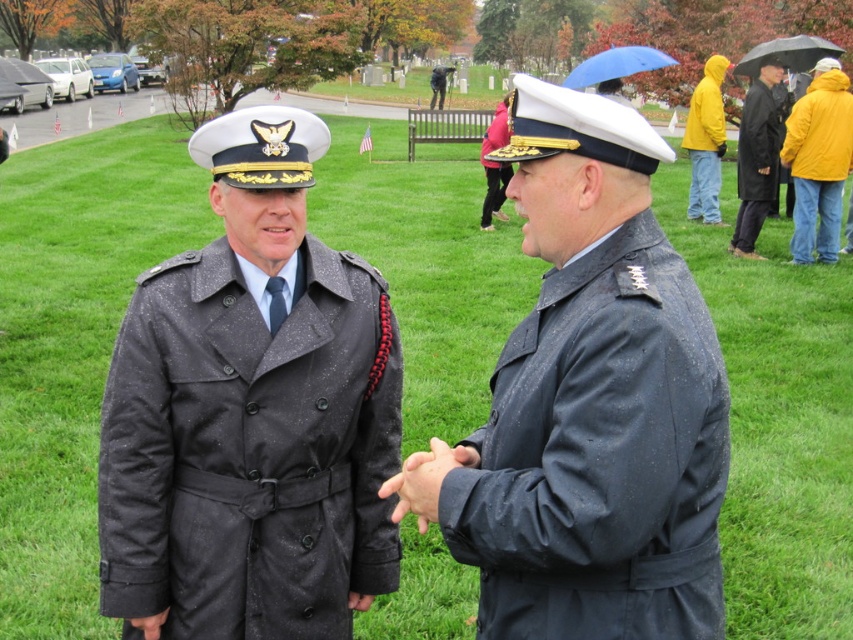
Question: Based on their relative distances, which object is nearer to the matte black trench coat at center?

Choices:
 (A) matte black uniform at center
 (B) yellow matte jacket at right

Answer: (A)

Question: Does matte black uniform at center have a lesser width compared to black leather coat at right?

Choices:
 (A) yes
 (B) no

Answer: (A)

Question: Does matte black trench coat at center appear on the right side of black leather coat at right?

Choices:
 (A) no
 (B) yes

Answer: (A)

Question: Which object is positioned farthest from the matte black trench coat at center?

Choices:
 (A) black leather coat at right
 (B) matte black uniform at center

Answer: (A)

Question: Which object is closer to the camera taking this photo?

Choices:
 (A) yellow matte jacket at right
 (B) black leather coat at right
 (C) matte black uniform at center
 (D) matte black trench coat at center

Answer: (C)

Question: Can you confirm if matte black trench coat at center is wider than black leather coat at right?

Choices:
 (A) no
 (B) yes

Answer: (A)